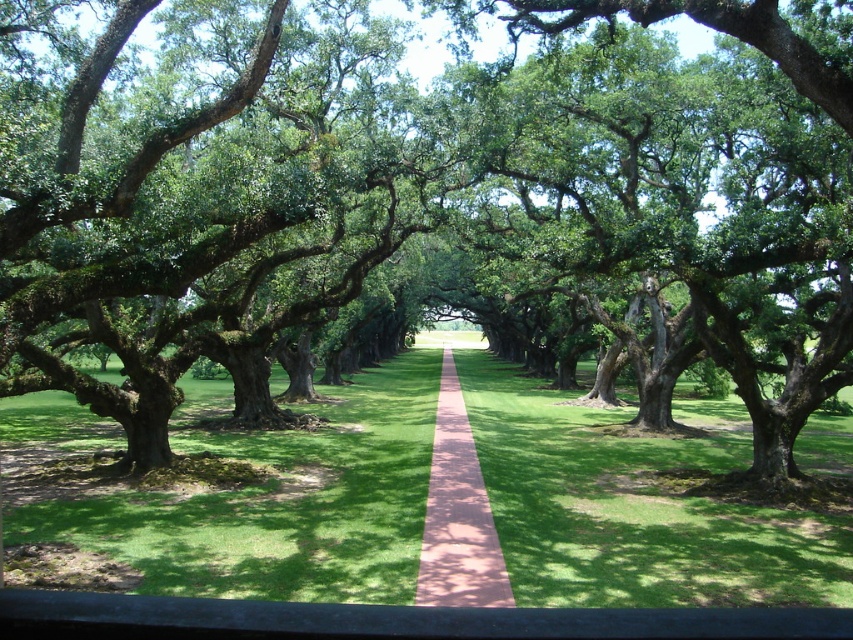
Question: Can you confirm if green grass at center is thinner than pink concrete path at center?

Choices:
 (A) no
 (B) yes

Answer: (A)

Question: Can you confirm if green grass at center is positioned to the left of pink concrete path at center?

Choices:
 (A) yes
 (B) no

Answer: (A)

Question: Which point is farther from the camera taking this photo?

Choices:
 (A) (421, 508)
 (B) (447, 568)

Answer: (A)

Question: Can you confirm if green grass at center is positioned below pink concrete path at center?

Choices:
 (A) no
 (B) yes

Answer: (B)